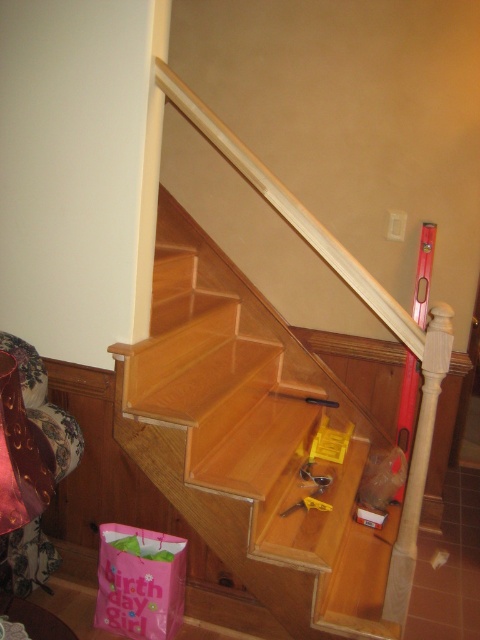
From the picture: Can you confirm if wooden at upper center is thinner than yellow plastic tool at center?

Incorrect, wooden at upper center's width is not less than yellow plastic tool at center's.

Which is above, wooden at upper center or yellow plastic tool at center?

wooden at upper center is higher up.

This screenshot has width=480, height=640. Describe the element at coordinates (363, 301) in the screenshot. I see `wooden at upper center` at that location.

Locate an element on the screen. wooden at upper center is located at coordinates (363, 301).